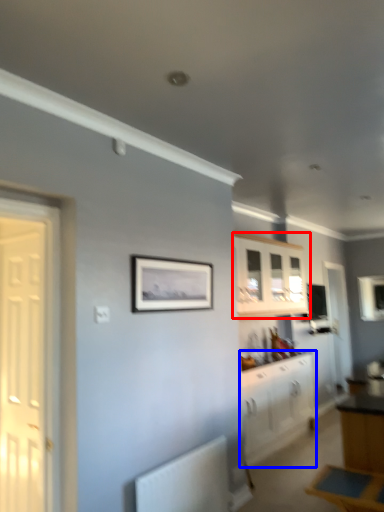
Question: Which object appears farthest to the camera in this image, cabinetry (highlighted by a red box) or cabinetry (highlighted by a blue box)?

Choices:
 (A) cabinetry
 (B) cabinetry

Answer: (A)